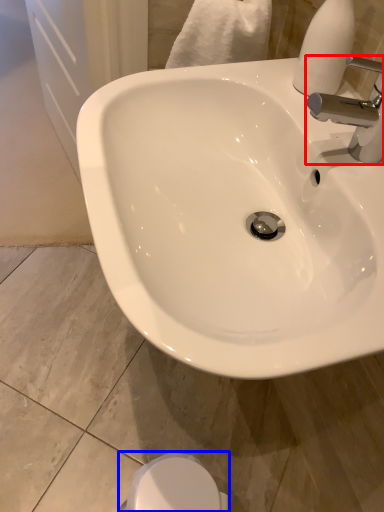
Question: Which object appears closest to the camera in this image, tap (highlighted by a red box) or bidet (highlighted by a blue box)?

Choices:
 (A) tap
 (B) bidet

Answer: (A)